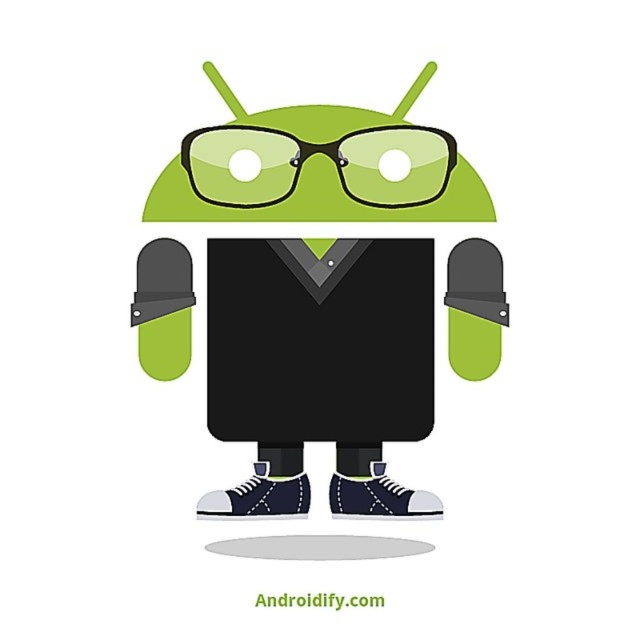
Question: Does matte black android at center have a larger size compared to green matte android head at upper center?

Choices:
 (A) no
 (B) yes

Answer: (B)

Question: Is matte black android at center thinner than green matte android head at upper center?

Choices:
 (A) no
 (B) yes

Answer: (A)

Question: Which object appears closest to the camera in this image?

Choices:
 (A) matte black android at center
 (B) green matte android head at upper center

Answer: (A)

Question: Can you confirm if matte black android at center is positioned below green matte android head at upper center?

Choices:
 (A) no
 (B) yes

Answer: (B)